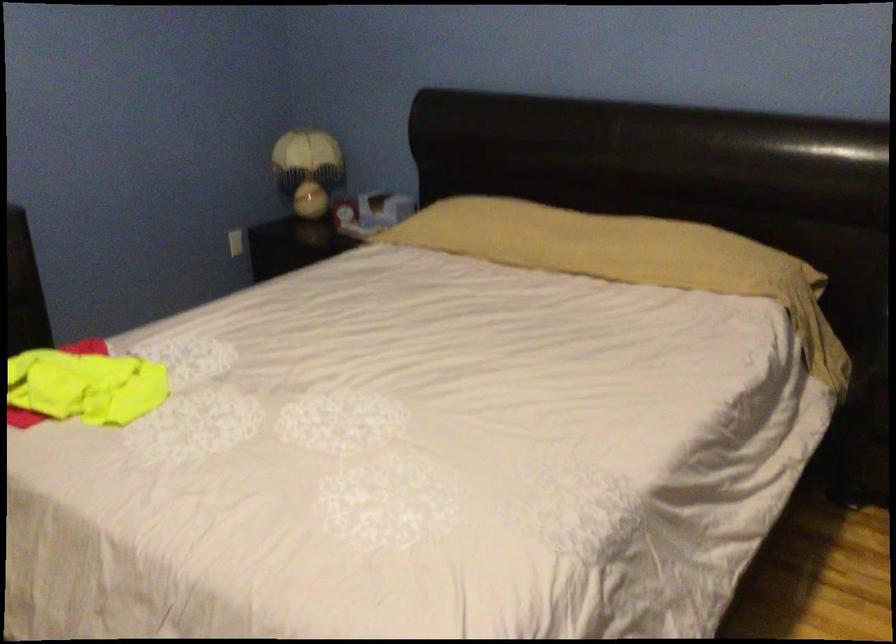
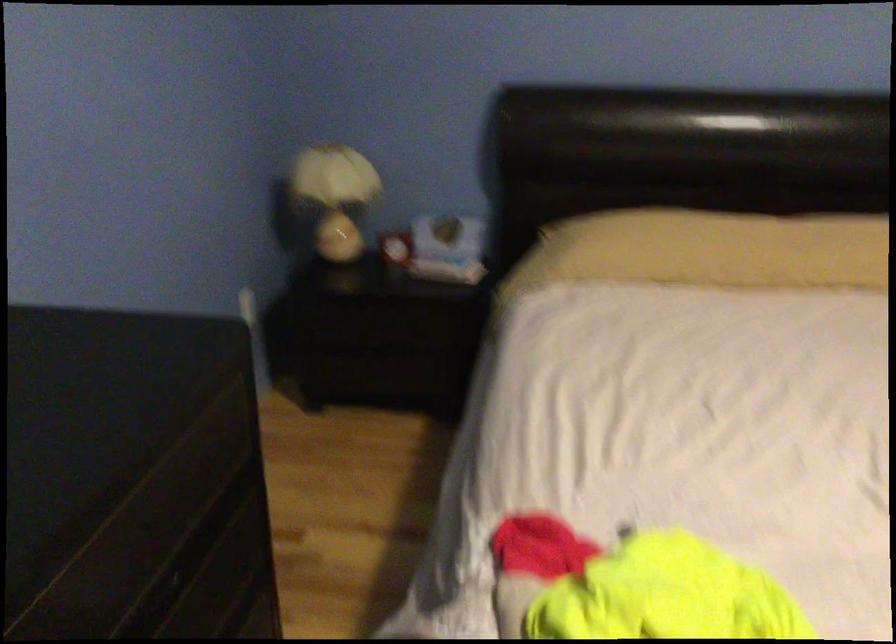
Looking at this image, what movement of the cameraman would produce the second image?

The cameraman walked toward left, forward.